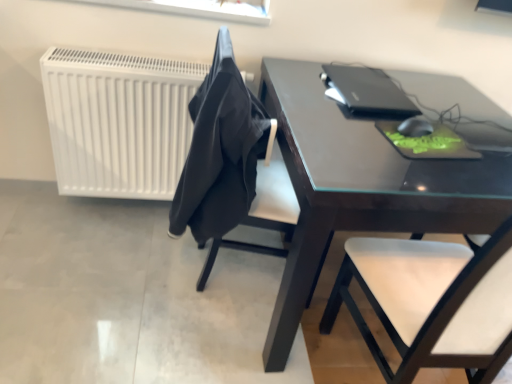
You are a GUI agent. You are given a task and a screenshot of the screen. Output one action in this format:
    pyautogui.click(x=<x>, y=<y>)
    Task: Click on the vacant area located to the right-hand side of black matte laptop at upper right
    
    Given the screenshot: What is the action you would take?
    pyautogui.click(x=442, y=105)